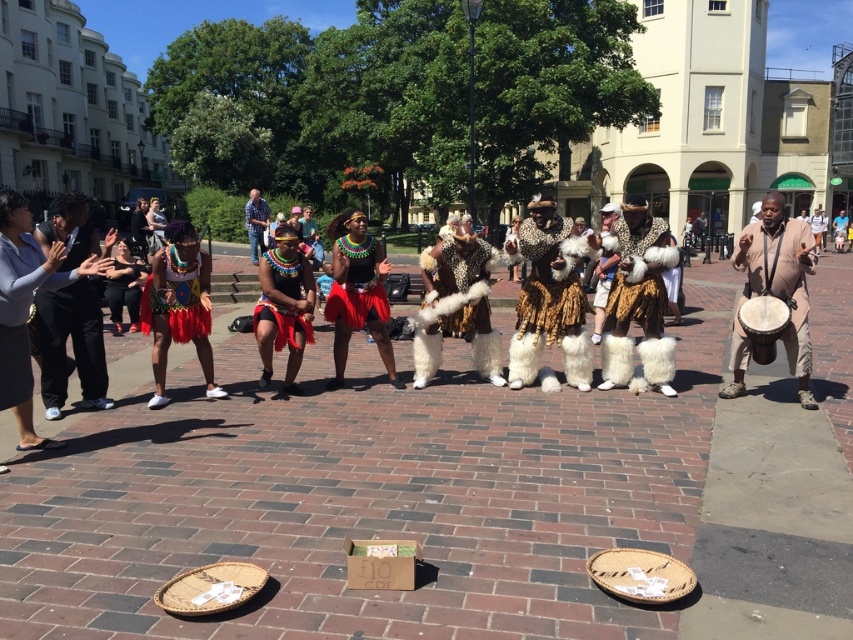
Question: Among these points, which one is farthest from the camera?

Choices:
 (A) (265, 227)
 (B) (436, 301)
 (C) (85, 348)
 (D) (384, 358)

Answer: (A)

Question: Among these objects, which one is nearest to the camera?

Choices:
 (A) shiny red fabric skirt at center
 (B) brown fur coat at center
 (C) multicolored fabric headdress at center

Answer: (C)

Question: Among these objects, which one is nearest to the camera?

Choices:
 (A) blue plaid shirt at center
 (B) shiny red fabric skirt at center
 (C) black suit at left
 (D) leopard print fur coat at center

Answer: (C)

Question: Can you confirm if shiny red fabric skirt at center is positioned to the left of shiny red skirt at center?

Choices:
 (A) yes
 (B) no

Answer: (A)

Question: Considering the relative positions of brown fur coat at center and shiny red skirt at center in the image provided, where is brown fur coat at center located with respect to shiny red skirt at center?

Choices:
 (A) left
 (B) right

Answer: (B)

Question: Is black suit at left bigger than shiny black fabric skirt at center?

Choices:
 (A) no
 (B) yes

Answer: (A)